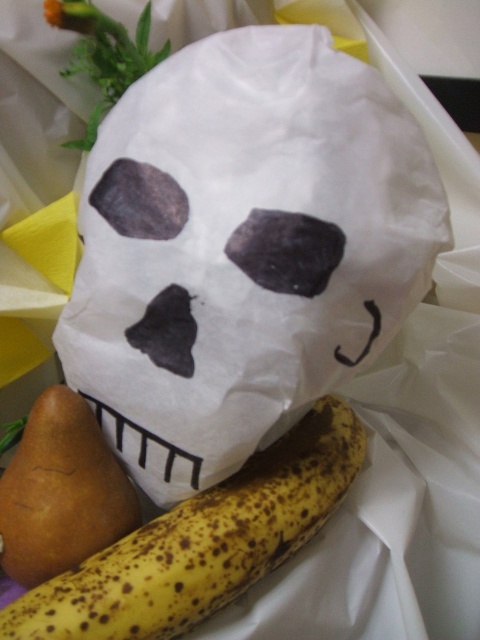
Question: Does yellow spotted banana at center lie in front of matte black nose at center?

Choices:
 (A) no
 (B) yes

Answer: (A)

Question: Which point is farther from the camera taking this photo?

Choices:
 (A) (189, 292)
 (B) (308, 58)
 (C) (74, 486)
 (D) (333, 483)

Answer: (D)

Question: Is yellow spotted banana at center below matte black nose at center?

Choices:
 (A) yes
 (B) no

Answer: (A)

Question: Which of these objects is positioned farthest from the brown matte pear at lower left?

Choices:
 (A) yellow spotted banana at center
 (B) white paper skull at center

Answer: (B)

Question: Is brown matte pear at lower left to the left of matte black nose at center from the viewer's perspective?

Choices:
 (A) yes
 (B) no

Answer: (A)

Question: Based on their relative distances, which object is nearer to the brown matte pear at lower left?

Choices:
 (A) yellow spotted banana at center
 (B) matte black nose at center

Answer: (A)